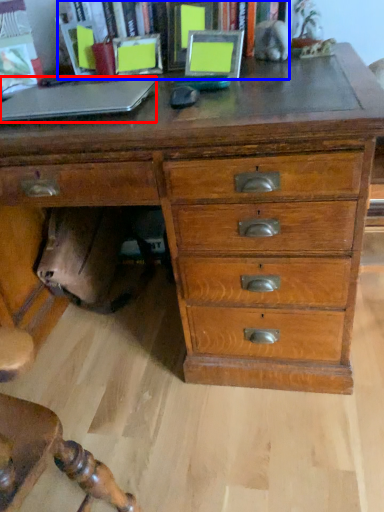
Question: Which object is closer to the camera taking this photo, laptop (highlighted by a red box) or bookcase (highlighted by a blue box)?

Choices:
 (A) laptop
 (B) bookcase

Answer: (A)